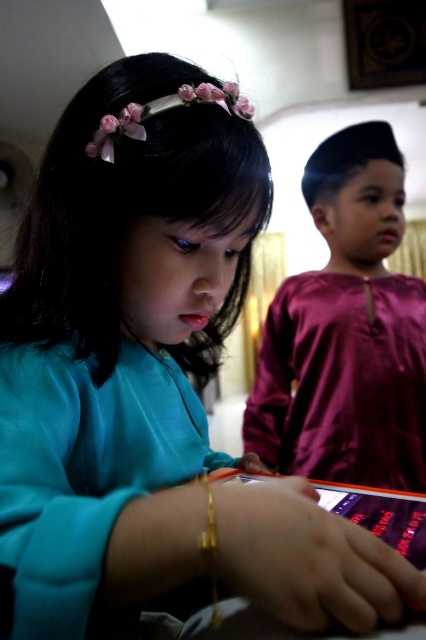
Who is more forward, [36,476] or [203,550]?

Point [203,550]

Is teal satin robe at lower left below gold metallic bracelet at lower center?

No.

Is point (183, 596) positioned before point (213, 616)?

No, (183, 596) is behind (213, 616).

Where is `teal satin robe at lower left`? The width and height of the screenshot is (426, 640). teal satin robe at lower left is located at coordinates (85, 472).

Can you confirm if purple glossy book at lower center is positioned to the right of gold metallic bracelet at lower center?

Correct, you'll find purple glossy book at lower center to the right of gold metallic bracelet at lower center.

Who is more distant from viewer, [236,476] or [207,497]?

Positioned behind is point [236,476].

The height and width of the screenshot is (640, 426). What are the coordinates of `purple glossy book at lower center` in the screenshot? It's located at (380, 515).

Can you confirm if shiny maroon shirt at center is positioned to the right of teal satin robe at lower left?

Indeed, shiny maroon shirt at center is positioned on the right side of teal satin robe at lower left.

Is shiny maroon shirt at center bigger than teal satin robe at lower left?

Yes.

Is point (351, 257) in front of point (163, 432)?

No, (351, 257) is further to viewer.

Locate an element on the screen. This screenshot has height=640, width=426. shiny maroon shirt at center is located at coordinates (347, 332).